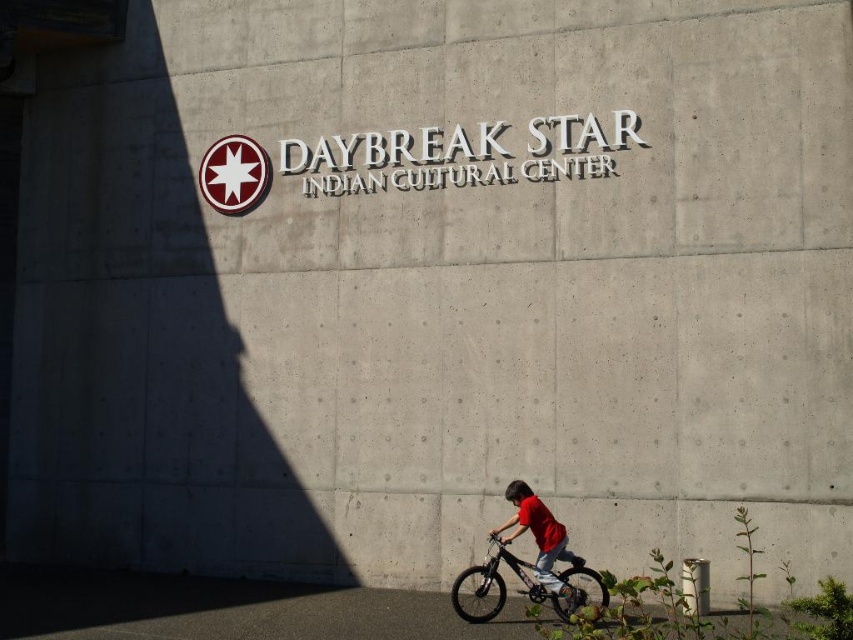
Between black matte bicycle at lower right and matte red shirt at lower right, which one is positioned lower?

black matte bicycle at lower right is below.

Is point (502, 582) farther from viewer compared to point (572, 605)?

Yes, it is.

Between point (461, 612) and point (517, 522), which one is positioned behind?

The point (517, 522) is more distant.

Identify the location of black matte bicycle at lower right. (523, 582).